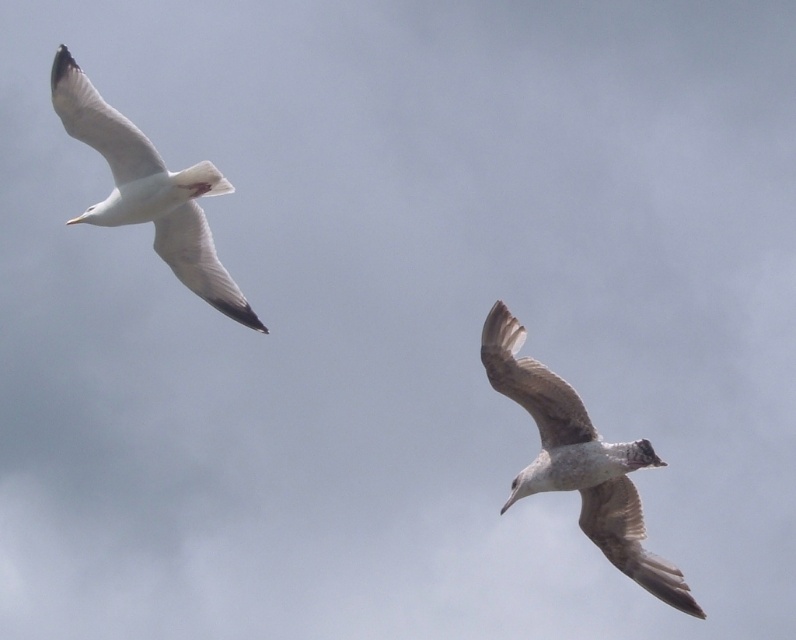
Can you confirm if light brown feathered bird at lower right is positioned above white feathered bird at upper left?

No, light brown feathered bird at lower right is not above white feathered bird at upper left.

Who is more distant from viewer, (510, 369) or (69, 129)?

Point (69, 129)

You are a GUI agent. You are given a task and a screenshot of the screen. Output one action in this format:
    pyautogui.click(x=<x>, y=<y>)
    Task: Click on the light brown feathered bird at lower right
    
    Given the screenshot: What is the action you would take?
    pyautogui.click(x=579, y=460)

This screenshot has height=640, width=796. Find the location of `light brown feathered bird at lower right`. light brown feathered bird at lower right is located at coordinates (579, 460).